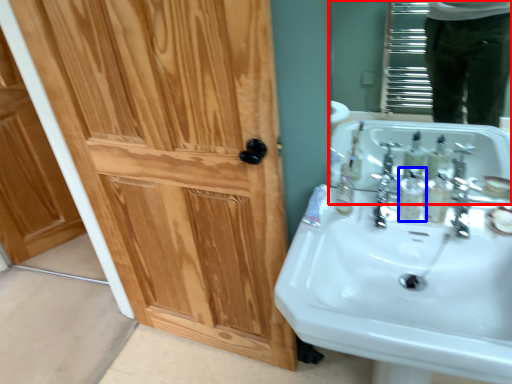
Question: Which of the following is the closest to the observer, mirror (highlighted by a red box) or mouthwash (highlighted by a blue box)?

Choices:
 (A) mirror
 (B) mouthwash

Answer: (A)